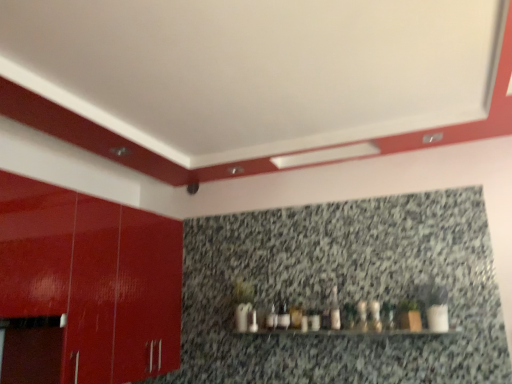
What is the approximate width of white glossy bottle at center, arranged as the first bottle when viewed from the left?

The width of white glossy bottle at center, arranged as the first bottle when viewed from the left, is 4.83 centimeters.

Identify the location of granite at upper center. (343, 290).

Identify the location of matte white bottle at center, the second bottle from the left. (362, 315).

The width and height of the screenshot is (512, 384). What are the coordinates of `white glossy bottle at center, the 3th bottle viewed from the right` in the screenshot? It's located at (335, 310).

Is glossy red cabinet at left not within white glossy bottle at center, arranged as the first bottle when viewed from the left?

Indeed, glossy red cabinet at left is completely outside white glossy bottle at center, arranged as the first bottle when viewed from the left.

From a real-world perspective, does glossy red cabinet at left stand above white glossy bottle at center, the 3th bottle viewed from the right?

Correct, in the physical world, glossy red cabinet at left is higher than white glossy bottle at center, the 3th bottle viewed from the right.

Would you say glossy red cabinet at left is a long distance from white glossy bottle at center, the 3th bottle viewed from the right?

That's right, there is a large distance between glossy red cabinet at left and white glossy bottle at center, the 3th bottle viewed from the right.

Would you say glossy red cabinet at left is to the left or to the right of white glossy bottle at center, arranged as the first bottle when viewed from the left, in the picture?

In the image, glossy red cabinet at left appears on the left side of white glossy bottle at center, arranged as the first bottle when viewed from the left.

Identify the location of bottle that is the 1st object located behind the glossy red cabinet at left. (375, 315).

Considering the points (375, 304) and (27, 288), which point is in front, point (375, 304) or point (27, 288)?

The point (27, 288) is closer to the camera.

In terms of width, does white glossy bottle at center, which ranks as the 1th bottle in right-to-left order, look wider or thinner when compared to glossy red cabinet at left?

Clearly, white glossy bottle at center, which ranks as the 1th bottle in right-to-left order, has less width compared to glossy red cabinet at left.

Can you tell me how much white glossy bottle at center, which ranks as the 1th bottle in right-to-left order, and glossy red cabinet at left differ in facing direction?

There is a 90.6-degree angle between the facing directions of white glossy bottle at center, which ranks as the 1th bottle in right-to-left order, and glossy red cabinet at left.

Would you say glossy red cabinet at left is part of matte white bottle at center, placed as the second bottle when sorted from right to left,'s contents?

Definitely not — glossy red cabinet at left is not inside matte white bottle at center, placed as the second bottle when sorted from right to left.

Can you confirm if matte white bottle at center, placed as the second bottle when sorted from right to left, is shorter than glossy red cabinet at left?

Yes, matte white bottle at center, placed as the second bottle when sorted from right to left, is shorter than glossy red cabinet at left.

The image size is (512, 384). Find the location of `cabinetry in front of the matte white bottle at center, the second bottle from the left`. cabinetry in front of the matte white bottle at center, the second bottle from the left is located at coordinates [x=93, y=278].

Is matte white bottle at center, the second bottle from the left, oriented away from glossy red cabinet at left?

No, glossy red cabinet at left is not at the back of matte white bottle at center, the second bottle from the left.

Considering the sizes of objects white glossy bottle at center, arranged as the first bottle when viewed from the left, and matte white bottle at center, placed as the second bottle when sorted from right to left, in the image provided, who is thinner, white glossy bottle at center, arranged as the first bottle when viewed from the left, or matte white bottle at center, placed as the second bottle when sorted from right to left,?

white glossy bottle at center, arranged as the first bottle when viewed from the left, is thinner.

From the picture: From the image's perspective, does white glossy bottle at center, arranged as the first bottle when viewed from the left, appear higher than matte white bottle at center, placed as the second bottle when sorted from right to left?

Yes.

Can we say white glossy bottle at center, the 3th bottle viewed from the right, lies outside matte white bottle at center, placed as the second bottle when sorted from right to left?

Yes, white glossy bottle at center, the 3th bottle viewed from the right, is outside of matte white bottle at center, placed as the second bottle when sorted from right to left.

Can you confirm if white glossy bottle at center, arranged as the first bottle when viewed from the left, is bigger than matte white bottle at center, the second bottle from the left?

No.

From a real-world perspective, which is physically below, white glossy bottle at center, the 3th bottle viewed from the right, or granite at upper center?

In real-world perspective, white glossy bottle at center, the 3th bottle viewed from the right, is lower.

How different are the orientations of white glossy bottle at center, arranged as the first bottle when viewed from the left, and granite at upper center in degrees?

They differ by 1.2 degrees in their facing directions.

Would you say white glossy bottle at center, the 3th bottle viewed from the right, is to the left or to the right of granite at upper center in the picture?

white glossy bottle at center, the 3th bottle viewed from the right, is positioned on granite at upper center's right side.

Is white glossy bottle at center, arranged as the first bottle when viewed from the left, not inside granite at upper center?

Yes.

Between white glossy bottle at center, the third bottle when ordered from left to right, and granite at upper center, which one has less height?

white glossy bottle at center, the third bottle when ordered from left to right, is shorter.

Between white glossy bottle at center, which ranks as the 1th bottle in right-to-left order, and granite at upper center, which one has smaller width?

Thinner between the two is granite at upper center.

Considering the sizes of objects white glossy bottle at center, which ranks as the 1th bottle in right-to-left order, and granite at upper center in the image provided, who is smaller, white glossy bottle at center, which ranks as the 1th bottle in right-to-left order, or granite at upper center?

With smaller size is white glossy bottle at center, which ranks as the 1th bottle in right-to-left order.

Considering the positions of objects white glossy bottle at center, the third bottle when ordered from left to right, and granite at upper center in the image provided, who is in front, white glossy bottle at center, the third bottle when ordered from left to right, or granite at upper center?

granite at upper center is closer to the camera.

Which is nearer, (138, 264) or (288, 247)?

The point (138, 264) is more forward.

Is glossy red cabinet at left far from granite at upper center?

No, there isn't a large distance between glossy red cabinet at left and granite at upper center.

Could you tell me if glossy red cabinet at left is facing granite at upper center?

Yes, glossy red cabinet at left is oriented towards granite at upper center.

Consider the image. From the image's perspective, which object appears higher, glossy red cabinet at left or granite at upper center?

From the image's view, glossy red cabinet at left is above.

Locate an element on the screen. Image resolution: width=512 pixels, height=384 pixels. cabinetry that is above the white glossy bottle at center, the 3th bottle viewed from the right (from the image's perspective) is located at coordinates (93, 278).

From the image's perspective, count 2nd bottles downward from the glossy red cabinet at left and point to it. Please provide its 2D coordinates.

[(375, 315)]

Based on the photo, which object lies further to the anchor point glossy red cabinet at left, white glossy bottle at center, the 3th bottle viewed from the right, or matte white bottle at center, the second bottle from the left?

Among the two, matte white bottle at center, the second bottle from the left, is located further to glossy red cabinet at left.

Estimate the real-world distances between objects in this image. Which object is closer to matte white bottle at center, the second bottle from the left, granite at upper center or white glossy bottle at center, arranged as the first bottle when viewed from the left?

white glossy bottle at center, arranged as the first bottle when viewed from the left, is positioned closer to the anchor matte white bottle at center, the second bottle from the left.

Estimate the real-world distances between objects in this image. Which object is further from glossy red cabinet at left, white glossy bottle at center, the 3th bottle viewed from the right, or white glossy bottle at center, which ranks as the 1th bottle in right-to-left order?

white glossy bottle at center, which ranks as the 1th bottle in right-to-left order.

From the image, which object appears to be nearer to glossy red cabinet at left, matte white bottle at center, placed as the second bottle when sorted from right to left, or white glossy bottle at center, the 3th bottle viewed from the right?

Among the two, white glossy bottle at center, the 3th bottle viewed from the right, is located nearer to glossy red cabinet at left.

Looking at the image, which one is located further to granite at upper center, white glossy bottle at center, the 3th bottle viewed from the right, or matte white bottle at center, placed as the second bottle when sorted from right to left?

matte white bottle at center, placed as the second bottle when sorted from right to left, is positioned further to the anchor granite at upper center.

Considering their positions, is granite at upper center positioned closer to white glossy bottle at center, the third bottle when ordered from left to right, than matte white bottle at center, placed as the second bottle when sorted from right to left?

Based on the image, matte white bottle at center, placed as the second bottle when sorted from right to left, appears to be nearer to white glossy bottle at center, the third bottle when ordered from left to right.

Estimate the real-world distances between objects in this image. Which object is closer to matte white bottle at center, the second bottle from the left, white glossy bottle at center, the third bottle when ordered from left to right, or white glossy bottle at center, arranged as the first bottle when viewed from the left?

white glossy bottle at center, the third bottle when ordered from left to right, is closer to matte white bottle at center, the second bottle from the left.

Estimate the real-world distances between objects in this image. Which object is closer to matte white bottle at center, the second bottle from the left, white glossy bottle at center, the third bottle when ordered from left to right, or glossy red cabinet at left?

white glossy bottle at center, the third bottle when ordered from left to right.

The height and width of the screenshot is (384, 512). I want to click on granite between glossy red cabinet at left and matte white bottle at center, the second bottle from the left, from left to right, so click(x=343, y=290).

Locate an element on the screen. granite between glossy red cabinet at left and white glossy bottle at center, arranged as the first bottle when viewed from the left is located at coordinates (343, 290).

The height and width of the screenshot is (384, 512). I want to click on bottle between white glossy bottle at center, arranged as the first bottle when viewed from the left, and white glossy bottle at center, which ranks as the 1th bottle in right-to-left order, from left to right, so click(362, 315).

Find the location of a particular element. The width and height of the screenshot is (512, 384). granite between glossy red cabinet at left and white glossy bottle at center, which ranks as the 1th bottle in right-to-left order, from left to right is located at coordinates (343, 290).